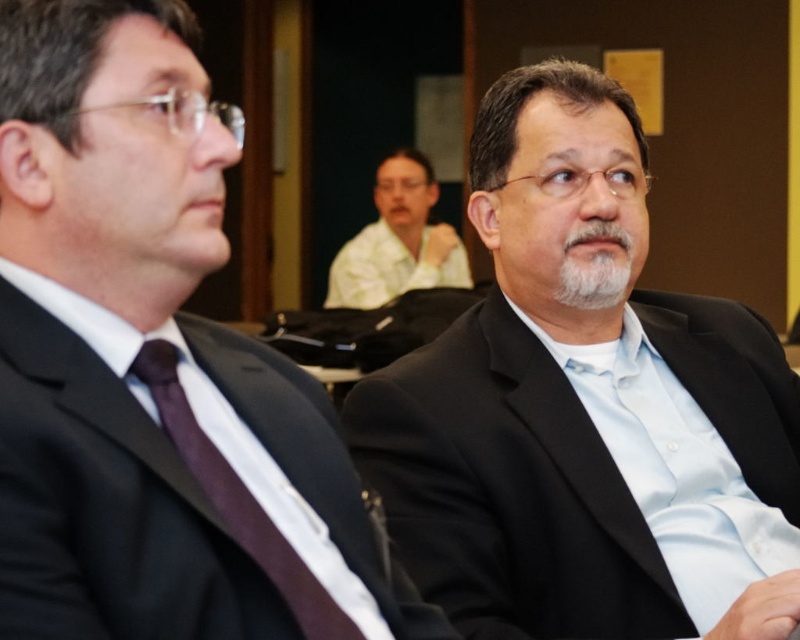
Who is positioned more to the right, black matte suit at center or dark purple silk tie at left?

From the viewer's perspective, black matte suit at center appears more on the right side.

Can you confirm if black matte suit at center is wider than dark purple silk tie at left?

Indeed, black matte suit at center has a greater width compared to dark purple silk tie at left.

Does point (605, 173) lie behind point (210, 442)?

Yes, it is.

Find the location of a particular element. The image size is (800, 640). black matte suit at center is located at coordinates (586, 406).

Does black suit at center have a smaller size compared to dark purple silk tie at left?

Incorrect, black suit at center is not smaller in size than dark purple silk tie at left.

Locate an element on the screen. This screenshot has height=640, width=800. black suit at center is located at coordinates (152, 368).

Who is more forward, (312, 625) or (389, 268)?

Point (312, 625) is in front.

Based on the photo, does dark purple silk tie at left come in front of light beige shirt at center?

Yes, it is in front of light beige shirt at center.

Describe the element at coordinates (237, 499) in the screenshot. I see `dark purple silk tie at left` at that location.

At what (x,y) coordinates should I click in order to perform the action: click on dark purple silk tie at left. Please return your answer as a coordinate pair (x, y). Looking at the image, I should click on (237, 499).